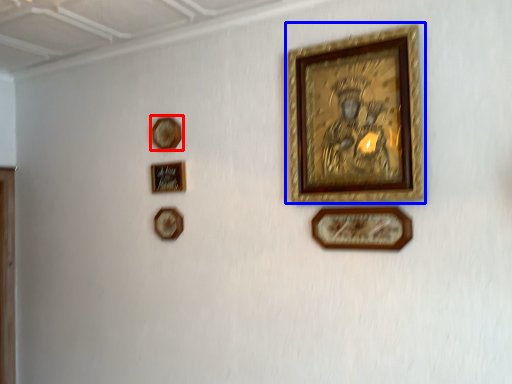
Question: Which point is closer to the camera, picture frame (highlighted by a red box) or picture frame (highlighted by a blue box)?

Choices:
 (A) picture frame
 (B) picture frame

Answer: (B)